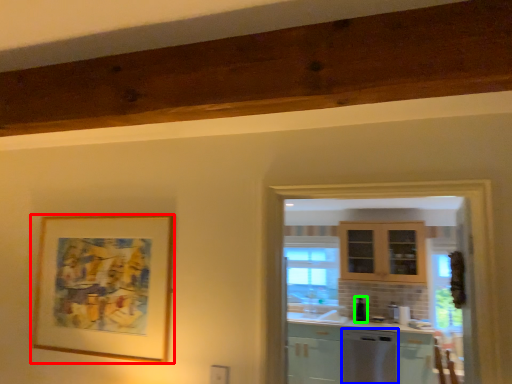
Question: Estimate the real-world distances between objects in this image. Which object is farther from picture frame (highlighted by a red box), dish washer (highlighted by a blue box) or appliance (highlighted by a green box)?

Choices:
 (A) dish washer
 (B) appliance

Answer: (B)